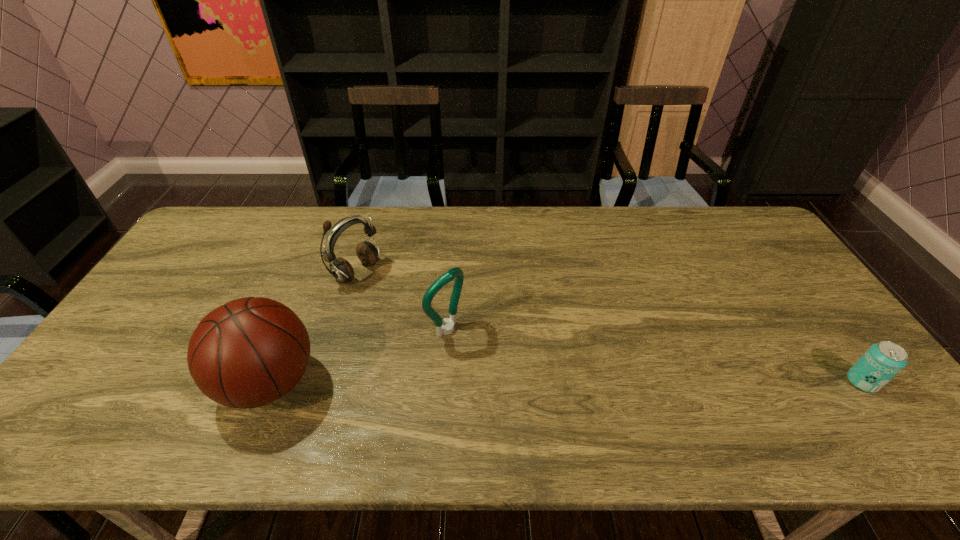
The image size is (960, 540). I want to click on free space between the earphone and the basketball, so click(x=313, y=327).

This screenshot has height=540, width=960. I want to click on empty space between the basketball and the farthest object, so click(x=313, y=327).

Locate an element on the screen. This screenshot has height=540, width=960. free space between the farthest object and the basketball is located at coordinates (313, 327).

Identify which object is the second closest to the bottle opener. Please provide its 2D coordinates. Your answer should be formatted as a tuple, i.e. [(x, y)], where the tuple contains the x and y coordinates of a point satisfying the conditions above.

[(249, 352)]

Where is `object identified as the closest to the third object from left to right`? object identified as the closest to the third object from left to right is located at coordinates (340, 268).

At what (x,y) coordinates should I click in order to perform the action: click on free spot that satisfies the following two spatial constraints: 1. on the front side of the bottle opener; 2. on the left side of the earphone. Please return your answer as a coordinate pair (x, y). Looking at the image, I should click on (340, 329).

Identify the location of vacant space that satisfies the following two spatial constraints: 1. on the back side of the basketball; 2. on the left side of the rightmost object. The width and height of the screenshot is (960, 540). [x=270, y=382].